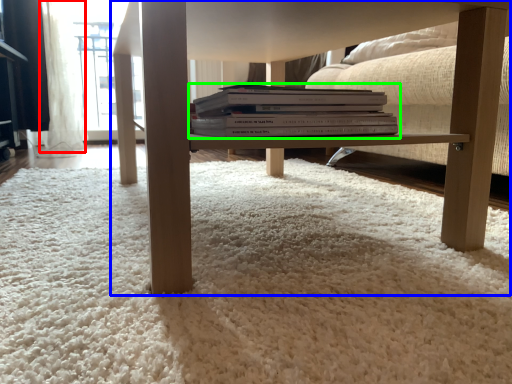
Question: Which is farther away from curtain (highlighted by a red box)? table (highlighted by a blue box) or book (highlighted by a green box)?

Choices:
 (A) table
 (B) book

Answer: (B)